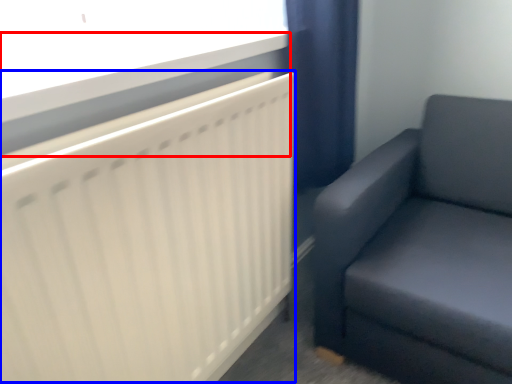
Question: Which object is further to the camera taking this photo, window sill (highlighted by a red box) or radiator (highlighted by a blue box)?

Choices:
 (A) window sill
 (B) radiator

Answer: (A)